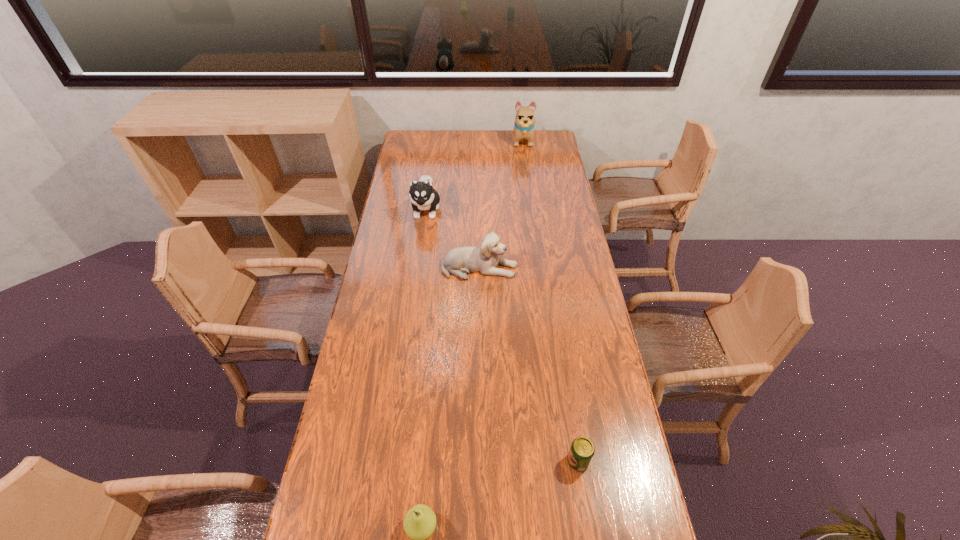
This screenshot has width=960, height=540. In order to click on blank space located 0.080m on the front-facing side of the nearest puppy in this screenshot , I will do `click(539, 268)`.

I want to click on vacant space situated 0.080m on the left of the beer can, so click(x=539, y=461).

This screenshot has height=540, width=960. What are the coordinates of `object that is at the far edge` in the screenshot? It's located at (524, 123).

Identify the location of object that is at the left edge. (423, 196).

Where is `puppy positioned at the right edge`? The height and width of the screenshot is (540, 960). puppy positioned at the right edge is located at coordinates (524, 123).

Find the location of `beer can present at the right edge`. beer can present at the right edge is located at coordinates (582, 450).

At what (x,y) coordinates should I click in order to perform the action: click on object that is at the far right corner. Please return your answer as a coordinate pair (x, y). The height and width of the screenshot is (540, 960). Looking at the image, I should click on (524, 123).

The width and height of the screenshot is (960, 540). Identify the location of free space at the far edge of the desktop. (470, 134).

You are a GUI agent. You are given a task and a screenshot of the screen. Output one action in this format:
    pyautogui.click(x=<x>, y=<y>)
    Task: Click on the vacant point at the left edge
    
    Given the screenshot: What is the action you would take?
    pyautogui.click(x=396, y=204)

Image resolution: width=960 pixels, height=540 pixels. I want to click on vacant space at the right edge of the desktop, so click(581, 244).